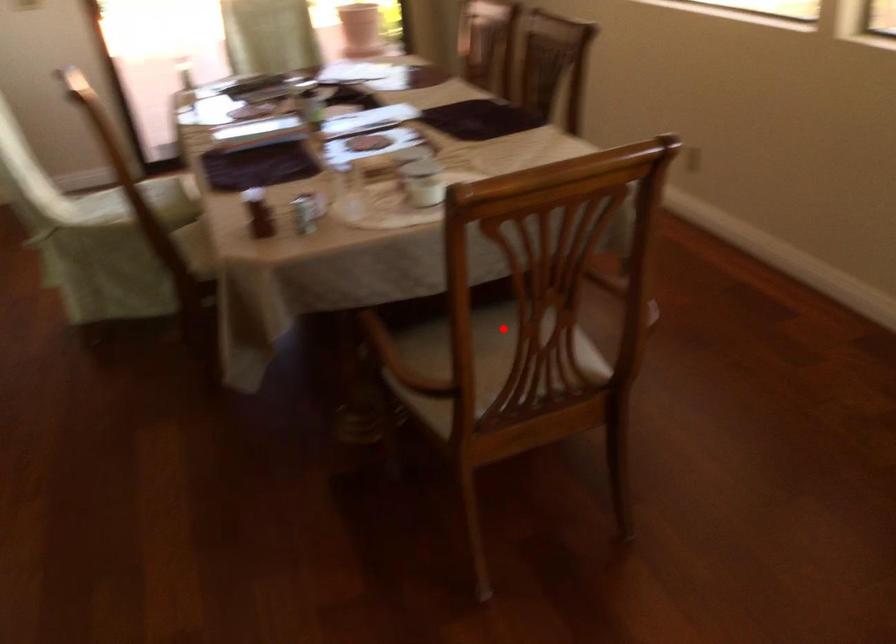
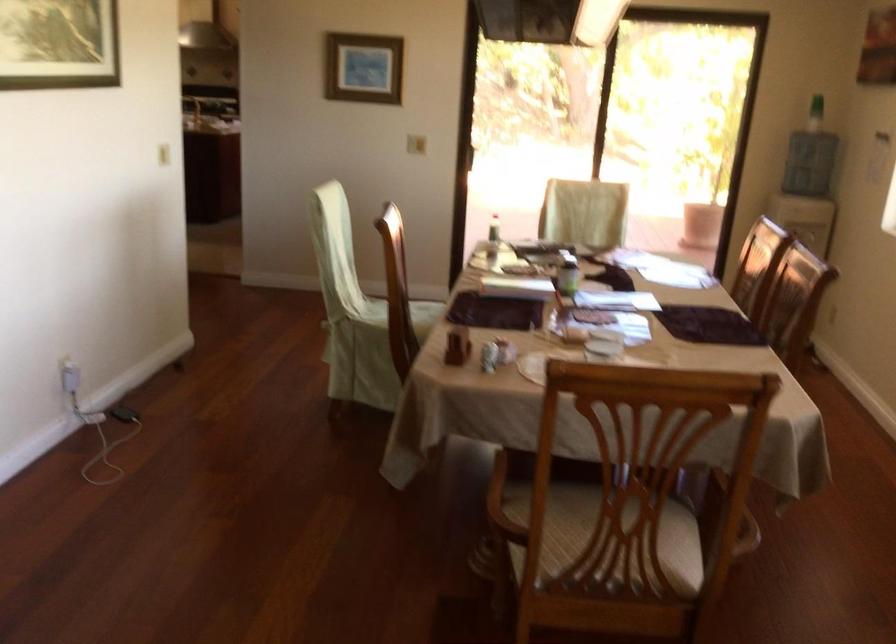
Where in the second image is the point corresponding to the highlighted location from the first image?

(631, 513)